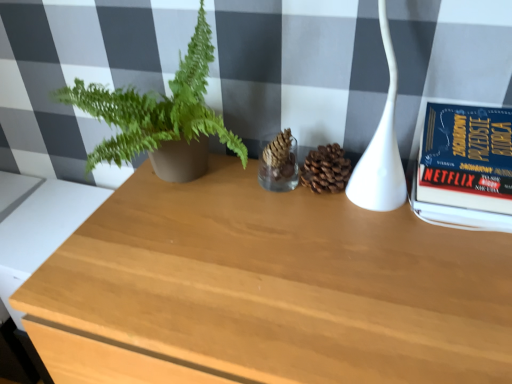
The height and width of the screenshot is (384, 512). I want to click on vacant region to the left of white glossy lamp at upper right, so click(x=287, y=220).